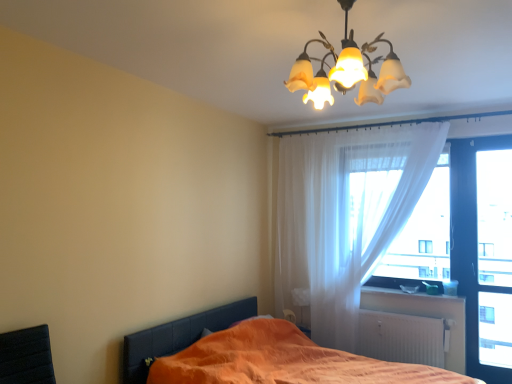
Question: Is translucent glass chandelier at upper center in front of or behind orange fabric bed at lower left in the image?

Choices:
 (A) behind
 (B) front

Answer: (B)

Question: From a real-world perspective, is translucent glass chandelier at upper center positioned above or below orange fabric bed at lower left?

Choices:
 (A) below
 (B) above

Answer: (B)

Question: Which object is the farthest from the translucent fabric at right, arranged as the second window screen when viewed from the right?

Choices:
 (A) white plastic window sill at lower right
 (B) orange fabric bed at lower left
 (C) translucent glass chandelier at upper center
 (D) translucent white curtain at upper right
 (E) white matte radiator at lower right

Answer: (C)

Question: Which is farther from the translucent glass chandelier at upper center?

Choices:
 (A) transparent glass door at right, marked as the 2th window screen in a left-to-right arrangement
 (B) translucent fabric at right, arranged as the second window screen when viewed from the right
 (C) orange fabric bed at lower left
 (D) white plastic window sill at lower right
 (E) white matte radiator at lower right

Answer: (D)